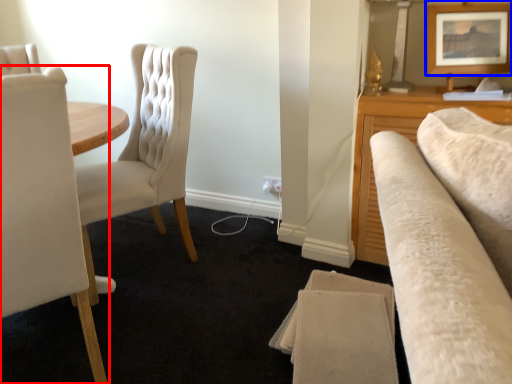
Question: Among these objects, which one is nearest to the camera, chair (highlighted by a red box) or picture frame (highlighted by a blue box)?

Choices:
 (A) chair
 (B) picture frame

Answer: (A)